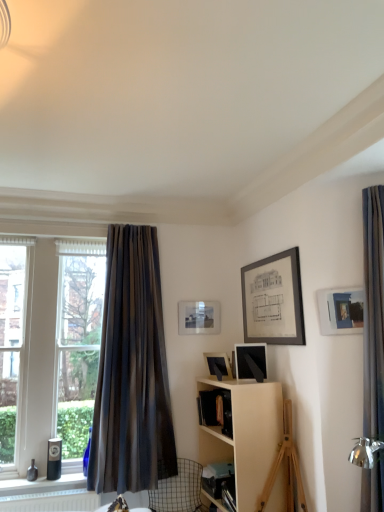
The width and height of the screenshot is (384, 512). Describe the element at coordinates (218, 365) in the screenshot. I see `matte black picture frame at center, marked as the third picture frame in a right-to-left arrangement` at that location.

The height and width of the screenshot is (512, 384). Find the location of `matte black picture frame at upper right, the 2th picture frame viewed from the front`. matte black picture frame at upper right, the 2th picture frame viewed from the front is located at coordinates (251, 361).

Find the location of a particular element. The width and height of the screenshot is (384, 512). dark gray textured curtain at left is located at coordinates (132, 371).

Describe the element at coordinates (132, 371) in the screenshot. Image resolution: width=384 pixels, height=512 pixels. I see `dark gray textured curtain at left` at that location.

You are a GUI agent. You are given a task and a screenshot of the screen. Output one action in this format:
    pyautogui.click(x=<x>, y=<y>)
    Task: Click on the clear glass window at left
    The width and height of the screenshot is (384, 512).
    Given the screenshot: What is the action you would take?
    pyautogui.click(x=48, y=349)

Image resolution: width=384 pixels, height=512 pixels. What are the coordinates of `picture frame that is the 1st object located above the matte black picture frame at center, the 2th picture frame in the back-to-front sequence (from the image's perspective)` in the screenshot? It's located at (251, 361).

Is the depth of matte black picture frame at upper right, the second picture frame positioned from the right, less than that of matte black picture frame at center, marked as the third picture frame in a right-to-left arrangement?

Yes, it is in front of matte black picture frame at center, marked as the third picture frame in a right-to-left arrangement.

Is matte black picture frame at upper right, which ranks as the third picture frame in back-to-front order, outside of matte black picture frame at center, marked as the third picture frame in a right-to-left arrangement?

matte black picture frame at upper right, which ranks as the third picture frame in back-to-front order, is positioned outside matte black picture frame at center, marked as the third picture frame in a right-to-left arrangement.

Can you tell me how much matte black picture frame at center, which is counted as the third picture frame, starting from the front, and metallic wire swivel chair at lower left differ in facing direction?

The angular difference between matte black picture frame at center, which is counted as the third picture frame, starting from the front, and metallic wire swivel chair at lower left is 127 degrees.

From the image's perspective, who appears lower, matte black picture frame at center, the 2th picture frame in the back-to-front sequence, or metallic wire swivel chair at lower left?

metallic wire swivel chair at lower left, from the image's perspective.

Considering the relative positions of matte black picture frame at center, the 2th picture frame in the back-to-front sequence, and metallic wire swivel chair at lower left in the image provided, is matte black picture frame at center, the 2th picture frame in the back-to-front sequence, to the left of metallic wire swivel chair at lower left from the viewer's perspective?

In fact, matte black picture frame at center, the 2th picture frame in the back-to-front sequence, is to the right of metallic wire swivel chair at lower left.

Considering the relative positions of matte black picture frame at center, which is counted as the third picture frame, starting from the front, and metallic wire swivel chair at lower left in the image provided, is matte black picture frame at center, which is counted as the third picture frame, starting from the front, behind metallic wire swivel chair at lower left?

Yes, it is behind metallic wire swivel chair at lower left.

Choose the correct answer: Is metallic wire swivel chair at lower left inside matte silver picture frame at upper center, the first picture frame positioned from the back, or outside it?

metallic wire swivel chair at lower left lies outside matte silver picture frame at upper center, the first picture frame positioned from the back.

From a real-world perspective, is metallic wire swivel chair at lower left physically located above or below matte silver picture frame at upper center, the first picture frame positioned from the back?

Result: From a real-world perspective, metallic wire swivel chair at lower left is physically below matte silver picture frame at upper center, the first picture frame positioned from the back.

Considering the sizes of objects metallic wire swivel chair at lower left and matte silver picture frame at upper center, marked as the 1th picture frame in a left-to-right arrangement, in the image provided, who is smaller, metallic wire swivel chair at lower left or matte silver picture frame at upper center, marked as the 1th picture frame in a left-to-right arrangement,?

matte silver picture frame at upper center, marked as the 1th picture frame in a left-to-right arrangement, is smaller.

Which is in front, matte silver picture frame at upper center, the first picture frame positioned from the back, or dark gray textured curtain at left?

Positioned in front is dark gray textured curtain at left.

How distant is matte silver picture frame at upper center, which is the 4th picture frame from front to back, from dark gray textured curtain at left?

25.32 inches.

Would you consider matte silver picture frame at upper center, the 4th picture frame viewed from the right, to be distant from dark gray textured curtain at left?

No, there isn't a large distance between matte silver picture frame at upper center, the 4th picture frame viewed from the right, and dark gray textured curtain at left.

Is matte silver picture frame at upper center, the first picture frame positioned from the back, taller than dark gray textured curtain at left?

No.

Is dark gray textured curtain at left next to matte black picture frame at center, marked as the third picture frame in a right-to-left arrangement, and touching it?

dark gray textured curtain at left and matte black picture frame at center, marked as the third picture frame in a right-to-left arrangement, are clearly separated.

Is dark gray textured curtain at left not within matte black picture frame at center, the 2th picture frame in the back-to-front sequence?

Yes, dark gray textured curtain at left is located beyond the bounds of matte black picture frame at center, the 2th picture frame in the back-to-front sequence.

Consider the image. From a real-world perspective, is dark gray textured curtain at left positioned over matte black picture frame at center, which is counted as the third picture frame, starting from the front, based on gravity?

Yes.

Considering the sizes of dark gray textured curtain at left and matte black picture frame at center, which is counted as the third picture frame, starting from the front, in the image, is dark gray textured curtain at left wider or thinner than matte black picture frame at center, which is counted as the third picture frame, starting from the front,?

dark gray textured curtain at left is wider than matte black picture frame at center, which is counted as the third picture frame, starting from the front.

Is metallic wire swivel chair at lower left bigger than clear glass window at left?

Incorrect, metallic wire swivel chair at lower left is not larger than clear glass window at left.

Is metallic wire swivel chair at lower left aimed at clear glass window at left?

No, metallic wire swivel chair at lower left does not turn towards clear glass window at left.

Is metallic wire swivel chair at lower left further to the viewer compared to clear glass window at left?

No, it is in front of clear glass window at left.

Is metallic wire swivel chair at lower left wider or thinner than clear glass window at left?

Clearly, metallic wire swivel chair at lower left has more width compared to clear glass window at left.

Can you confirm if clear glass window at left is thinner than matte silver picture frame at upper center, which is the 4th picture frame from front to back?

Answer: Incorrect, the width of clear glass window at left is not less than that of matte silver picture frame at upper center, which is the 4th picture frame from front to back.

Looking at this image, from a real-world perspective, is clear glass window at left on top of matte silver picture frame at upper center, which is the 4th picture frame from front to back?

No.

Considering the relative sizes of clear glass window at left and matte silver picture frame at upper center, which is the 4th picture frame from front to back, in the image provided, is clear glass window at left shorter than matte silver picture frame at upper center, which is the 4th picture frame from front to back,?

In fact, clear glass window at left may be taller than matte silver picture frame at upper center, which is the 4th picture frame from front to back.

Are clear glass window at left and matte silver picture frame at upper center, which is the 4th picture frame from front to back, making contact?

clear glass window at left and matte silver picture frame at upper center, which is the 4th picture frame from front to back, are not in contact.

Identify the location of picture frame that is the 1st object to the right of the matte black picture frame at center, which is counted as the third picture frame, starting from the front, starting at the anchor. The image size is (384, 512). (251, 361).

The width and height of the screenshot is (384, 512). In order to click on swivel chair to the left of matte black picture frame at center, which is counted as the third picture frame, starting from the front in this screenshot , I will do `click(179, 490)`.

Estimate the real-world distances between objects in this image. Which object is closer to metallic wire swivel chair at lower left, matte black picture frame at upper right, the 3th picture frame in the left-to-right sequence, or clear glass window at left?

The object closer to metallic wire swivel chair at lower left is matte black picture frame at upper right, the 3th picture frame in the left-to-right sequence.

Considering their positions, is matte white picture frame at upper right, the first picture frame when ordered from front to back, positioned closer to matte black picture frame at center, which is counted as the third picture frame, starting from the front, than dark gray textured curtain at left?

dark gray textured curtain at left.

When comparing their distances from metallic wire swivel chair at lower left, does dark gray textured curtain at left or matte black picture frame at center, which is counted as the third picture frame, starting from the front, seem further?

matte black picture frame at center, which is counted as the third picture frame, starting from the front, is positioned further to the anchor metallic wire swivel chair at lower left.

Based on their spatial positions, is matte white picture frame at upper right, which is the fourth picture frame from left to right, or matte black picture frame at center, which is counted as the third picture frame, starting from the front, further from matte silver picture frame at upper center, the 4th picture frame viewed from the right?

Among the two, matte white picture frame at upper right, which is the fourth picture frame from left to right, is located further to matte silver picture frame at upper center, the 4th picture frame viewed from the right.

Based on their spatial positions, is clear glass window at left or matte white picture frame at upper right, which is the fourth picture frame from left to right, closer to metallic wire swivel chair at lower left?

clear glass window at left lies closer to metallic wire swivel chair at lower left than the other object.

Based on their spatial positions, is matte black picture frame at center, the 2th picture frame in the back-to-front sequence, or clear glass window at left further from matte silver picture frame at upper center, the 4th picture frame viewed from the right?

clear glass window at left is further to matte silver picture frame at upper center, the 4th picture frame viewed from the right.

Looking at the image, which one is located further to metallic wire swivel chair at lower left, matte white picture frame at upper right, which is the fourth picture frame from left to right, or matte black picture frame at center, marked as the third picture frame in a right-to-left arrangement?

Based on the image, matte white picture frame at upper right, which is the fourth picture frame from left to right, appears to be further to metallic wire swivel chair at lower left.

Estimate the real-world distances between objects in this image. Which object is further from matte black picture frame at upper right, the 2th picture frame viewed from the front, matte black picture frame at center, which is counted as the third picture frame, starting from the front, or matte silver picture frame at upper center, which is the 4th picture frame from front to back?

Among the two, matte silver picture frame at upper center, which is the 4th picture frame from front to back, is located further to matte black picture frame at upper right, the 2th picture frame viewed from the front.

Where is `curtain between matte white picture frame at upper right, which appears as the fourth picture frame when viewed from the back, and metallic wire swivel chair at lower left in the up-down direction`? curtain between matte white picture frame at upper right, which appears as the fourth picture frame when viewed from the back, and metallic wire swivel chair at lower left in the up-down direction is located at coordinates (132, 371).

The width and height of the screenshot is (384, 512). Find the location of `picture frame between matte black picture frame at center, marked as the third picture frame in a right-to-left arrangement, and matte white picture frame at upper right, which is the fourth picture frame from left to right, in the horizontal direction`. picture frame between matte black picture frame at center, marked as the third picture frame in a right-to-left arrangement, and matte white picture frame at upper right, which is the fourth picture frame from left to right, in the horizontal direction is located at coordinates (251, 361).

Locate an element on the screen. The height and width of the screenshot is (512, 384). swivel chair located between clear glass window at left and matte black picture frame at upper right, the second picture frame positioned from the right, in the left-right direction is located at coordinates (179, 490).

In order to click on picture frame between dark gray textured curtain at left and matte silver picture frame at upper center, marked as the 1th picture frame in a left-to-right arrangement, along the z-axis in this screenshot , I will do tap(218, 365).